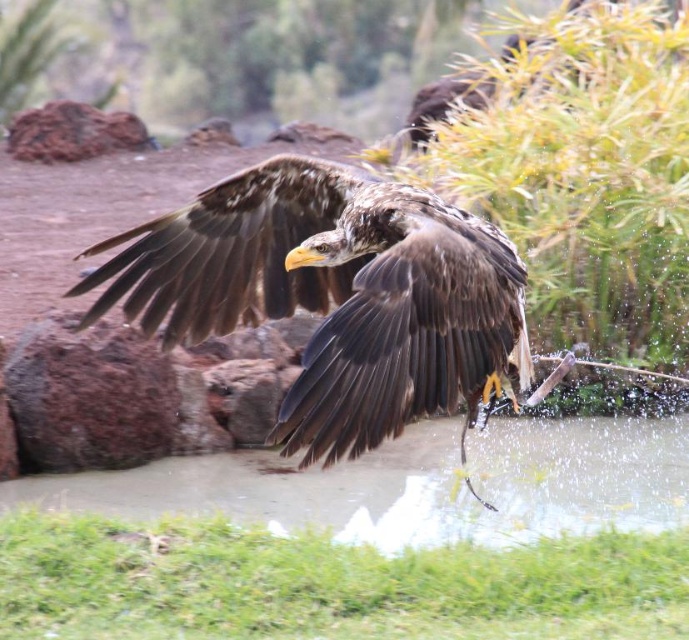
Question: Which point is farther to the camera?

Choices:
 (A) brown feathered eagle at center
 (B) clear water at lower center

Answer: (B)

Question: Considering the relative positions of brown feathered eagle at center and clear water at lower center in the image provided, where is brown feathered eagle at center located with respect to clear water at lower center?

Choices:
 (A) above
 (B) below

Answer: (A)

Question: Observing the image, what is the correct spatial positioning of brown feathered eagle at center in reference to clear water at lower center?

Choices:
 (A) above
 (B) below

Answer: (A)

Question: Where is brown feathered eagle at center located in relation to clear water at lower center in the image?

Choices:
 (A) left
 (B) right

Answer: (B)

Question: Which of the following is the farthest from the observer?

Choices:
 (A) (316, 474)
 (B) (309, 168)

Answer: (A)